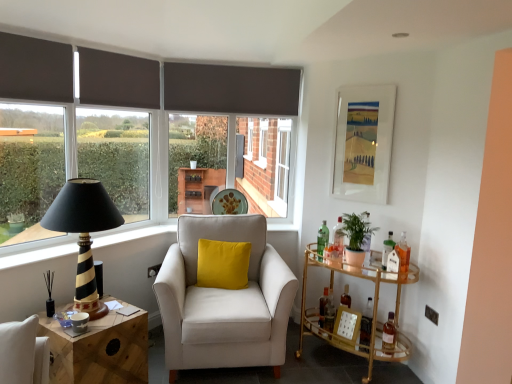
Question: Is dark grey fabric curtain at upper center, which appears as the first curtain when viewed from the back, taller than black fabric window screen at left?

Choices:
 (A) no
 (B) yes

Answer: (A)

Question: Considering the relative positions of dark grey fabric curtain at upper center, which ranks as the 2th curtain in left-to-right order, and black fabric window screen at left in the image provided, is dark grey fabric curtain at upper center, which ranks as the 2th curtain in left-to-right order, to the left of black fabric window screen at left from the viewer's perspective?

Choices:
 (A) yes
 (B) no

Answer: (B)

Question: Could black fabric window screen at left be considered to be inside dark grey fabric curtain at upper center, which ranks as the 2th curtain in left-to-right order?

Choices:
 (A) no
 (B) yes

Answer: (A)

Question: Does dark grey fabric curtain at upper center, marked as the 2th curtain in a front-to-back arrangement, lie behind black fabric window screen at left?

Choices:
 (A) no
 (B) yes

Answer: (B)

Question: From a real-world perspective, is dark grey fabric curtain at upper center, which appears as the first curtain when viewed from the back, on black fabric window screen at left?

Choices:
 (A) yes
 (B) no

Answer: (A)

Question: Considering the relative sizes of dark grey fabric curtain at upper center, the 1th curtain in the right-to-left sequence, and black fabric window screen at left in the image provided, is dark grey fabric curtain at upper center, the 1th curtain in the right-to-left sequence, thinner than black fabric window screen at left?

Choices:
 (A) yes
 (B) no

Answer: (A)

Question: From the image's perspective, would you say matte brown curtain at left is positioned over green leafy plant at right?

Choices:
 (A) no
 (B) yes

Answer: (B)

Question: From a real-world perspective, is matte brown curtain at left positioned over green leafy plant at right based on gravity?

Choices:
 (A) yes
 (B) no

Answer: (A)

Question: Is matte brown curtain at left looking in the opposite direction of green leafy plant at right?

Choices:
 (A) no
 (B) yes

Answer: (A)

Question: Can you confirm if matte brown curtain at left is positioned to the left of green leafy plant at right?

Choices:
 (A) yes
 (B) no

Answer: (A)

Question: Does matte brown curtain at left have a larger size compared to green leafy plant at right?

Choices:
 (A) yes
 (B) no

Answer: (A)

Question: Can you confirm if matte brown curtain at left is taller than green leafy plant at right?

Choices:
 (A) yes
 (B) no

Answer: (A)

Question: From a real-world perspective, does gold glass bar cart at right, the 1th table when ordered from right to left, sit lower than metallic silver power outlet at lower right?

Choices:
 (A) yes
 (B) no

Answer: (A)